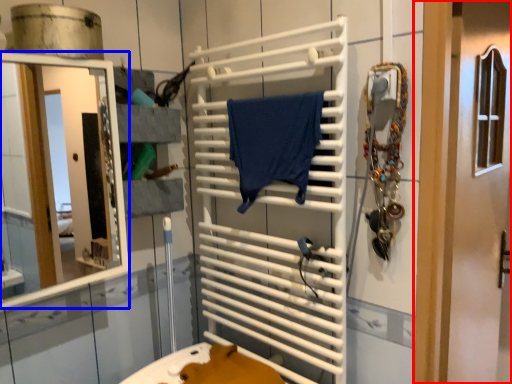
Question: Which object is further to the camera taking this photo, door (highlighted by a red box) or mirror (highlighted by a blue box)?

Choices:
 (A) door
 (B) mirror

Answer: (A)